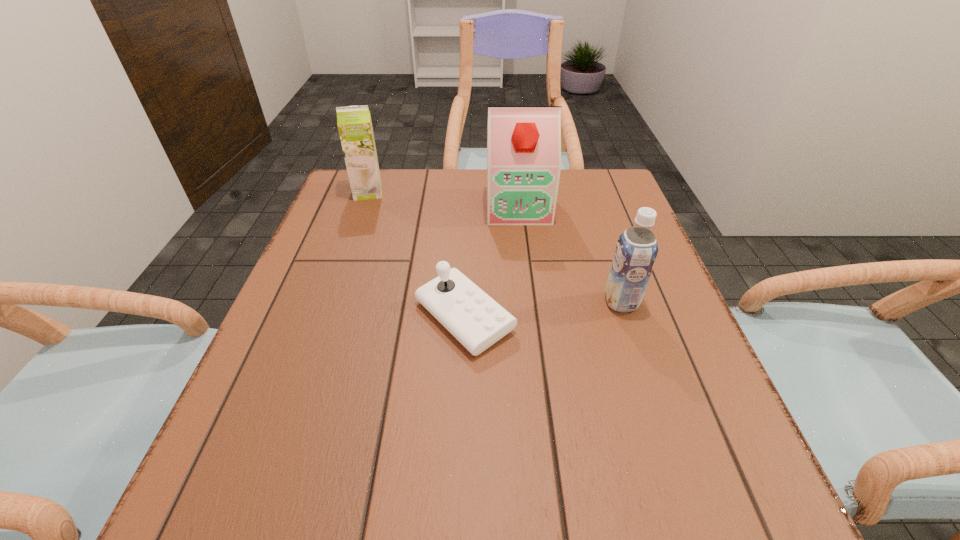
The height and width of the screenshot is (540, 960). Find the location of `the second soya milk from left to right`. the second soya milk from left to right is located at coordinates [523, 142].

Image resolution: width=960 pixels, height=540 pixels. I want to click on the leftmost object, so click(354, 123).

The image size is (960, 540). Identify the location of the rightmost soya milk. (636, 250).

Where is `the nearest soya milk`? Image resolution: width=960 pixels, height=540 pixels. the nearest soya milk is located at coordinates (636, 250).

Locate an element on the screen. the shortest object is located at coordinates (477, 321).

You are a GUI agent. You are given a task and a screenshot of the screen. Output one action in this format:
    pyautogui.click(x=<x>, y=<y>)
    Task: Click on the free space located with the cap open on the second soya milk from left to right
    
    Given the screenshot: What is the action you would take?
    pyautogui.click(x=523, y=248)

What are the coordinates of `vacant space located on the front of the leftmost object` in the screenshot? It's located at (360, 214).

The image size is (960, 540). In order to click on vacant position located 0.380m on the label of the rightmost soya milk in this screenshot , I will do `click(416, 302)`.

Locate an element on the screen. Image resolution: width=960 pixels, height=540 pixels. vacant region located 0.350m on the label of the rightmost soya milk is located at coordinates (431, 302).

Where is `vacant area located 0.150m on the label of the rightmost soya milk`? Image resolution: width=960 pixels, height=540 pixels. vacant area located 0.150m on the label of the rightmost soya milk is located at coordinates tap(531, 302).